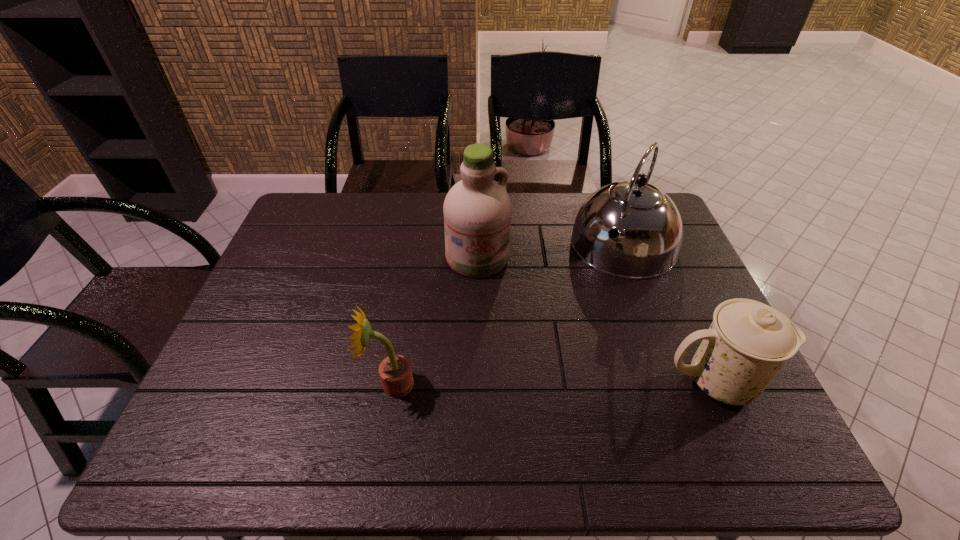
Where is `the leftmost object`? the leftmost object is located at coordinates (395, 371).

Where is `chinaware`? chinaware is located at coordinates (748, 342).

Find the location of a particular element. This screenshot has width=960, height=540. the second object from left to right is located at coordinates (477, 210).

At what (x,y) coordinates should I click in order to perform the action: click on kettle. Please return your answer as a coordinate pair (x, y). The width and height of the screenshot is (960, 540). Looking at the image, I should click on (650, 227).

Identify the location of free space located on the face of the leftmost object. (261, 384).

Where is `vacant region located 0.280m on the face of the leftmost object`? The image size is (960, 540). vacant region located 0.280m on the face of the leftmost object is located at coordinates (249, 384).

Locate an element on the screen. free space located 0.050m on the face of the leftmost object is located at coordinates (348, 384).

At what (x,y) coordinates should I click in order to perform the action: click on free location located on the front label of the cleansing agent. Please return your answer as a coordinate pair (x, y). Looking at the image, I should click on (491, 296).

Find the location of a particular element. This screenshot has width=960, height=540. free region located on the front label of the cleansing agent is located at coordinates (511, 357).

This screenshot has width=960, height=540. I want to click on free space located 0.370m on the front label of the cleansing agent, so click(521, 388).